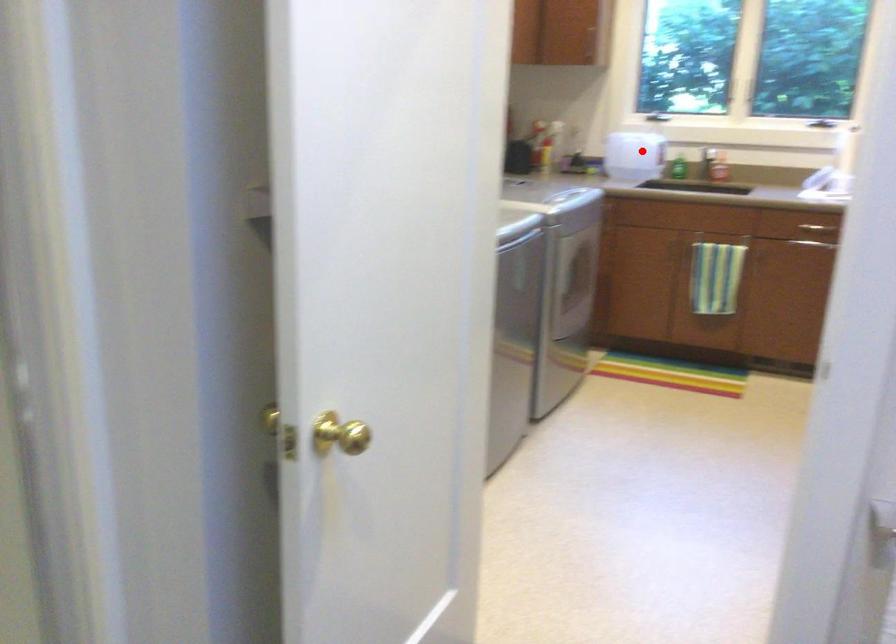
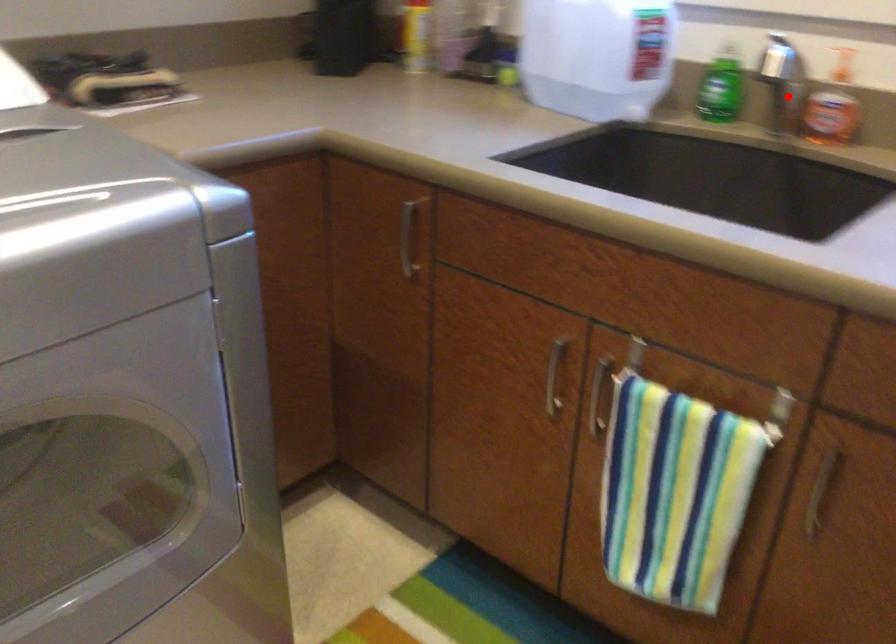
Consider the image. I am providing you with two images of the same scene from different viewpoints. A red point is marked on the first image and another point is marked on the second image. Are the points marked in image1 and image2 representing the same 3D position?

No